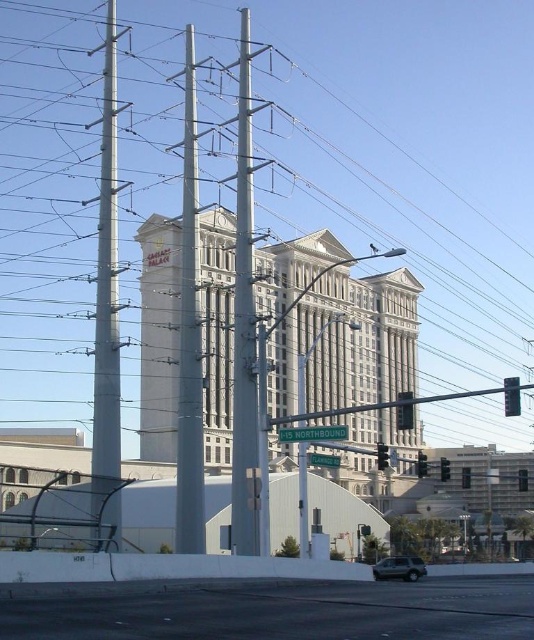
You are a photographer standing at the camera position. You want to capture a photo of the MGM Grand building in the background. However, there is a white metallic pole at left blocking the view. Can you estimate how far you need to move forward to ensure the pole is no longer in the frame?

The white metallic pole at left is currently 52.75 meters away from the camera. To ensure it is no longer blocking the view of the MGM Grand building, you would need to move forward so that the pole is out of the frame. However, the exact distance required depends on the camera lens and framing, but moving closer would reduce the pole appearing in front of the building.

You are a pedestrian standing on the sidewalk and want to cross the street. You see a metallic gray pole at center and a metallic traffic light at center right. Which object is closer to you?

The metallic gray pole at center is closer to you because it is further to the viewer than the metallic traffic light at center right.

You are a city planner assessing the safety of the street layout. The white metallic pole at center and the black glass traffic light at center right are both in the same area. Given that the minimum required distance between such structures for safety is 20 meters, is the current spacing compliant with safety standards?

The white metallic pole at center is 22.88 meters from the black glass traffic light at center right. Since this distance exceeds the 20 meters safety requirement, the current spacing complies with safety standards.